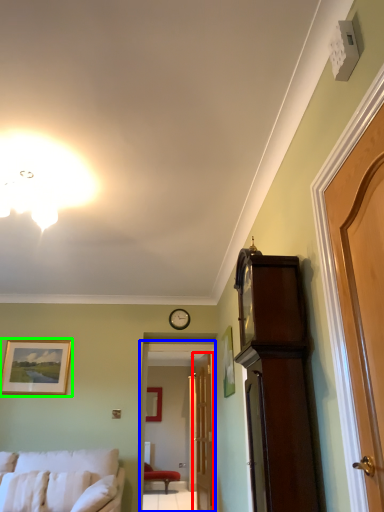
Question: Considering the real-world distances, which object is farthest from door (highlighted by a red box)? glass door (highlighted by a blue box) or picture frame (highlighted by a green box)?

Choices:
 (A) glass door
 (B) picture frame

Answer: (B)